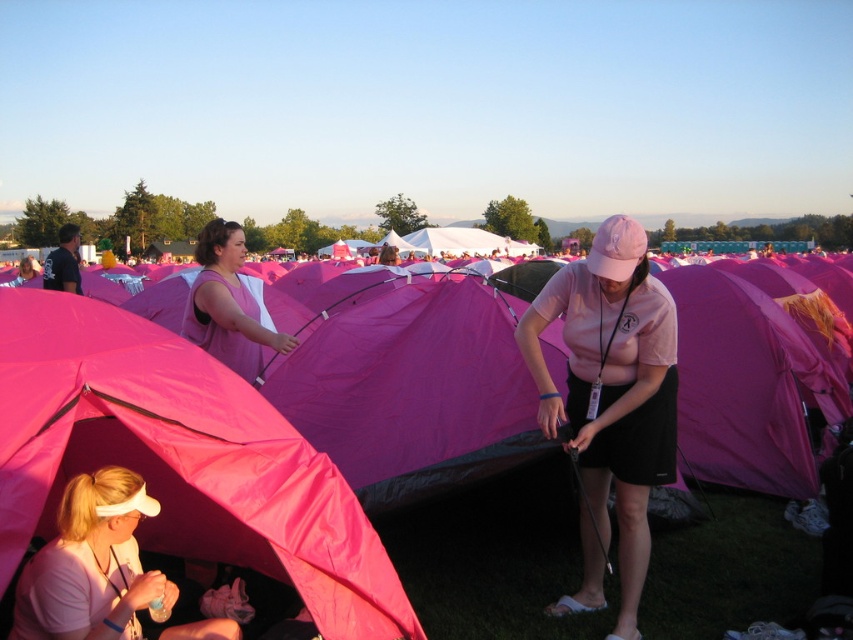
Does pink nylon tent at center have a smaller size compared to pink matte shirt at center?

No, pink nylon tent at center is not smaller than pink matte shirt at center.

Which is behind, point (407, 589) or point (585, 284)?

The point (407, 589) is more distant.

Locate an element on the screen. The width and height of the screenshot is (853, 640). pink nylon tent at center is located at coordinates (494, 556).

Can you confirm if pink matte shirt at center is positioned above pink matte visor at lower left?

Yes.

Measure the distance from pink matte shirt at center to pink matte visor at lower left.

A distance of 2.26 meters exists between pink matte shirt at center and pink matte visor at lower left.

Is point (548, 291) positioned behind point (128, 630)?

Yes, it is behind point (128, 630).

At what (x,y) coordinates should I click in order to perform the action: click on pink matte shirt at center. Please return your answer as a coordinate pair (x, y). The height and width of the screenshot is (640, 853). Looking at the image, I should click on (610, 401).

Find the location of a particular element. This screenshot has width=853, height=640. pink matte visor at lower left is located at coordinates (93, 564).

Does pink matte visor at lower left appear over matte pink tent at center?

No, pink matte visor at lower left is not above matte pink tent at center.

Is point (142, 634) positioned in front of point (247, 337)?

Yes.

This screenshot has height=640, width=853. I want to click on pink matte visor at lower left, so click(93, 564).